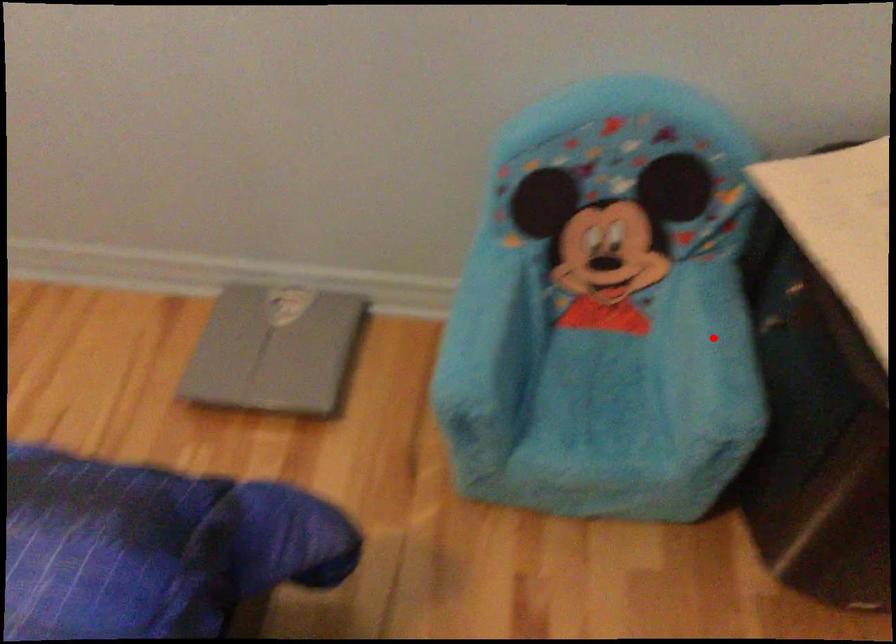
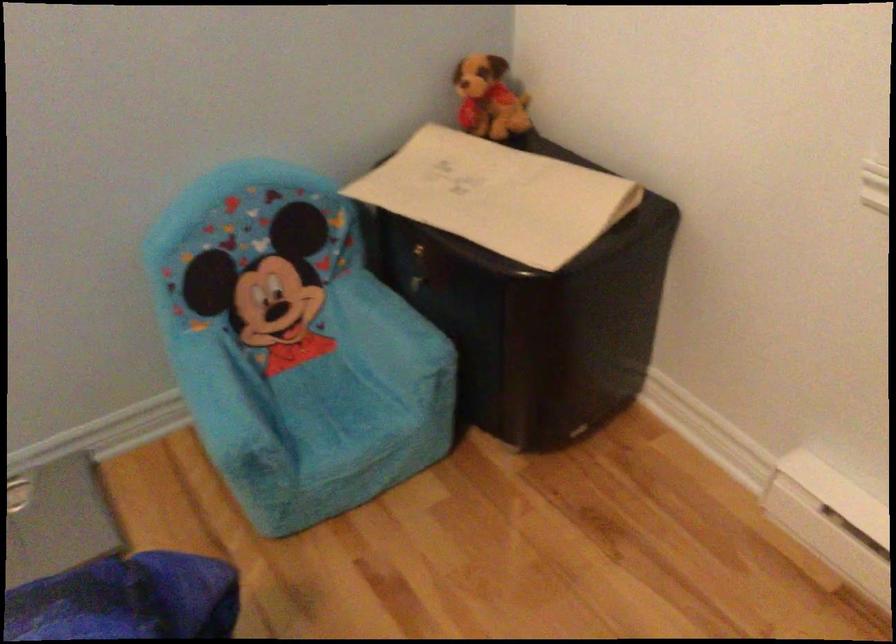
Locate, in the second image, the point that corresponds to the highlighted location in the first image.

(389, 316)